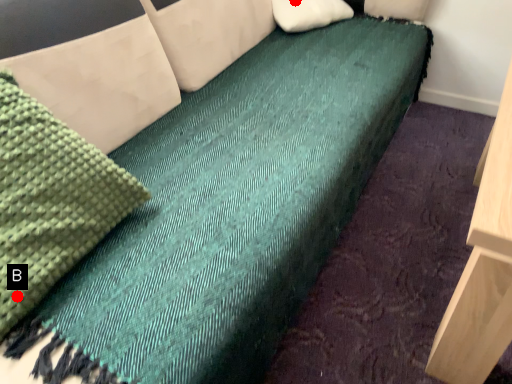
Question: Two points are circled on the image, labeled by A and B beside each circle. Which point is further to the camera?

Choices:
 (A) A is further
 (B) B is further

Answer: (A)